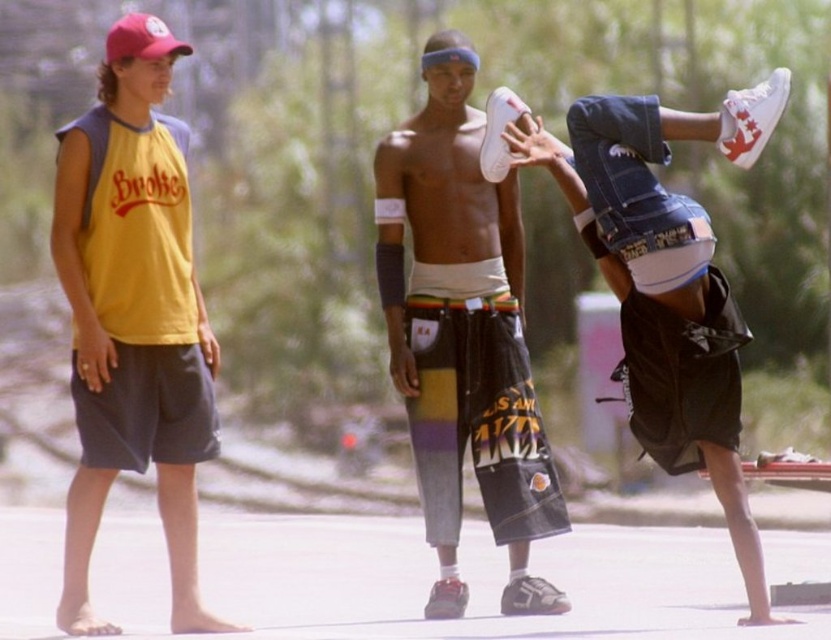
Can you confirm if white cotton shorts at center is positioned above red fabric baseball cap at upper left?

No, white cotton shorts at center is not above red fabric baseball cap at upper left.

Which is more to the right, white cotton shorts at center or red fabric baseball cap at upper left?

white cotton shorts at center

The height and width of the screenshot is (640, 831). What do you see at coordinates (463, 333) in the screenshot?
I see `white cotton shorts at center` at bounding box center [463, 333].

Find the location of a particular element. white cotton shorts at center is located at coordinates (463, 333).

Is point (123, 218) more distant than point (505, 218)?

No, it is in front of (505, 218).

Is point (74, 252) closer to viewer compared to point (559, 516)?

Yes, point (74, 252) is closer to viewer.

The height and width of the screenshot is (640, 831). I want to click on yellow fabric tank top at left, so click(133, 328).

Image resolution: width=831 pixels, height=640 pixels. Find the location of `white matte sneakers at center`. white matte sneakers at center is located at coordinates (654, 257).

Who is higher up, white matte sneakers at center or red fabric baseball cap at upper left?

red fabric baseball cap at upper left is higher up.

Which is in front, point (502, 173) or point (146, 48)?

Positioned in front is point (146, 48).

The image size is (831, 640). I want to click on white matte sneakers at center, so click(x=654, y=257).